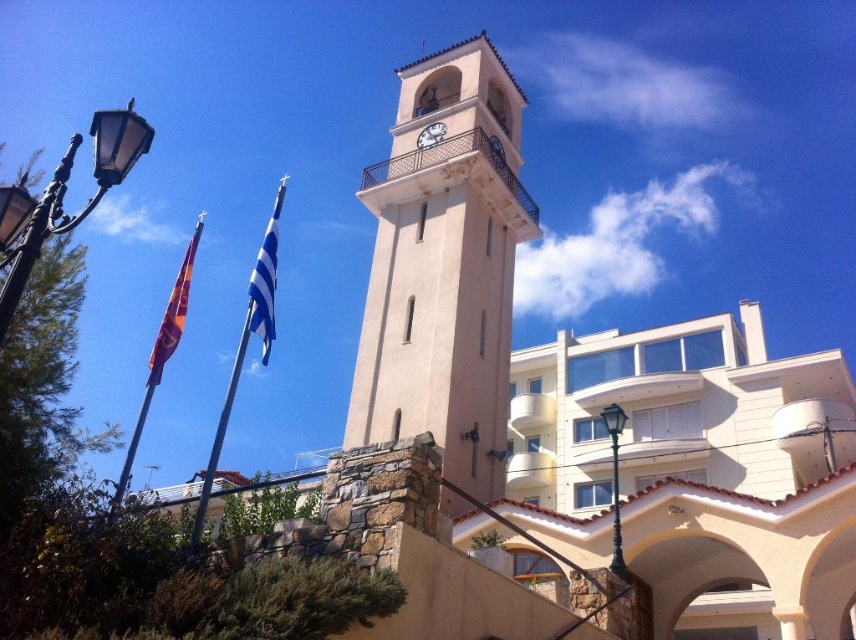
Between blue fabric flag at upper left and white textured clock at upper center, which one appears on the right side from the viewer's perspective?

Positioned to the right is white textured clock at upper center.

Can you confirm if blue fabric flag at upper left is shorter than white textured clock at upper center?

Incorrect, blue fabric flag at upper left's height does not fall short of white textured clock at upper center's.

Which is behind, point (262, 278) or point (423, 141)?

Positioned behind is point (423, 141).

Locate an element on the screen. blue fabric flag at upper left is located at coordinates (265, 282).

The width and height of the screenshot is (856, 640). Describe the element at coordinates (444, 266) in the screenshot. I see `beige stone clock tower at center` at that location.

Who is more forward, (419, 273) or (428, 144)?

Point (419, 273) is in front.

Find the location of `beige stone clock tower at center`. beige stone clock tower at center is located at coordinates (444, 266).

Between point (498, 211) and point (254, 273), which one is positioned behind?

The point (498, 211) is more distant.

Is beige stone clock tower at center to the right of blue fabric flag at upper left from the viewer's perspective?

Correct, you'll find beige stone clock tower at center to the right of blue fabric flag at upper left.

Does point (506, 376) come in front of point (260, 314)?

No, (506, 376) is behind (260, 314).

Locate an element on the screen. beige stone clock tower at center is located at coordinates (444, 266).